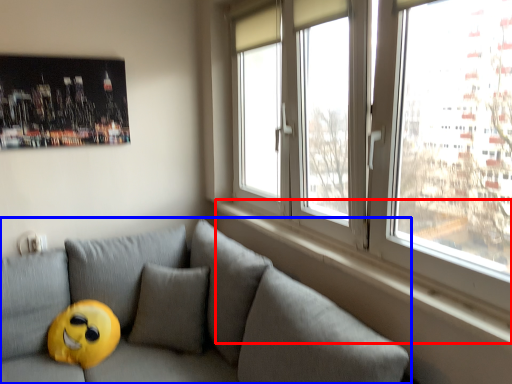
Question: Which object is further to the camera taking this photo, window sill (highlighted by a red box) or studio couch (highlighted by a blue box)?

Choices:
 (A) window sill
 (B) studio couch

Answer: (A)